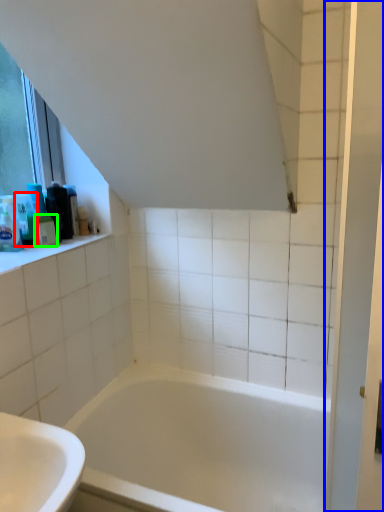
Question: Which object is positioned closest to toiletry (highlighted by a red box)? Select from screen door (highlighted by a blue box) and toiletry (highlighted by a green box).

Choices:
 (A) screen door
 (B) toiletry

Answer: (B)